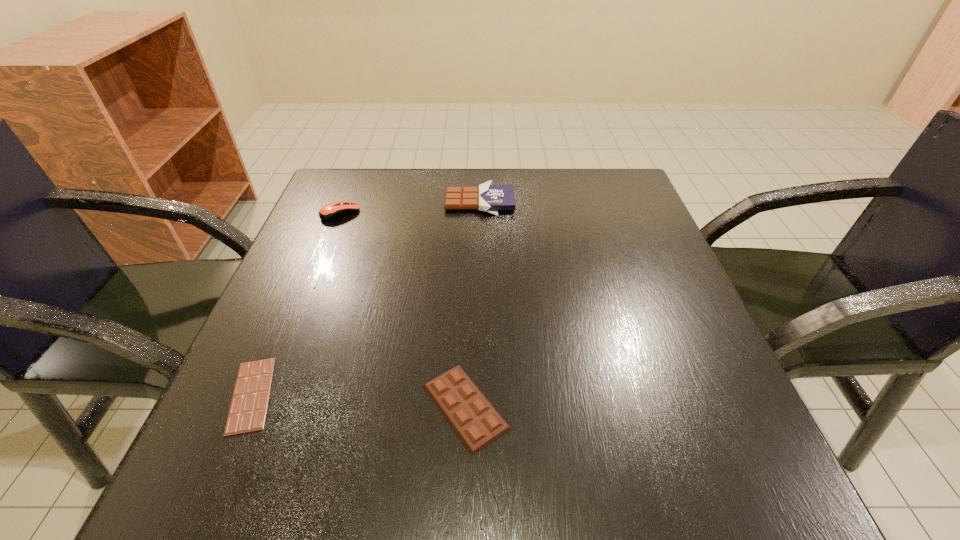
The image size is (960, 540). Identify the location of computer mouse that is at the far edge. tap(333, 211).

Where is `computer mouse present at the left edge`? computer mouse present at the left edge is located at coordinates (333, 211).

This screenshot has width=960, height=540. I want to click on chocolate bar located in the left edge section of the desktop, so click(249, 404).

Find the location of `object present at the far left corner`. object present at the far left corner is located at coordinates (333, 211).

This screenshot has width=960, height=540. In order to click on object at the near left corner in this screenshot , I will do `click(249, 404)`.

I want to click on vacant space at the far edge of the desktop, so coord(514,184).

The width and height of the screenshot is (960, 540). In the image, there is a desktop. Find the location of `vacant space at the near edge`. vacant space at the near edge is located at coordinates (593, 498).

Where is `free point at the left edge`? This screenshot has height=540, width=960. free point at the left edge is located at coordinates (279, 301).

At what (x,y) coordinates should I click in order to perform the action: click on free space at the right edge of the desktop. Please return your answer as a coordinate pair (x, y). The width and height of the screenshot is (960, 540). Looking at the image, I should click on (593, 225).

Where is `vacant space at the far left corner of the desktop`? The image size is (960, 540). vacant space at the far left corner of the desktop is located at coordinates (363, 197).